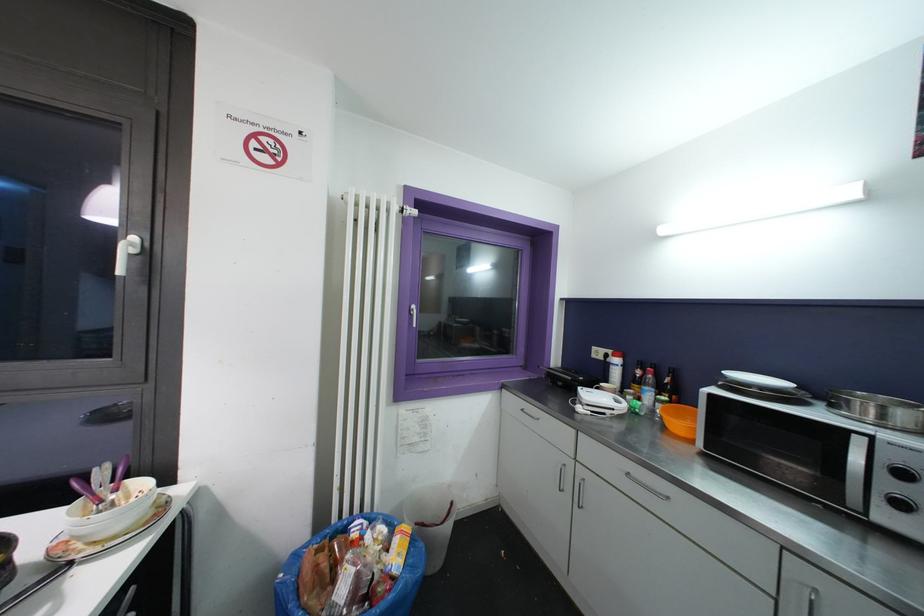
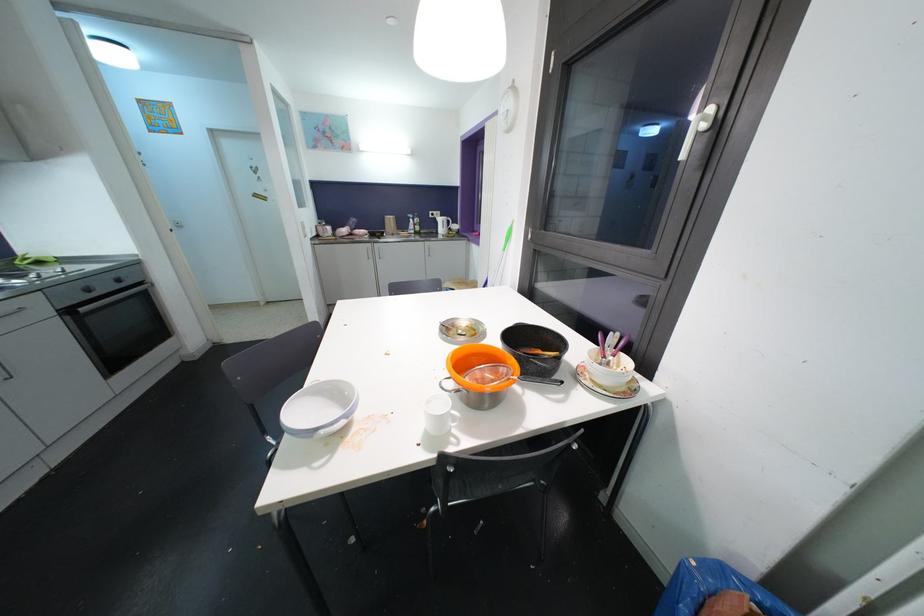
Find the pixel in the second image that matches (138,241) in the first image.

(713, 111)